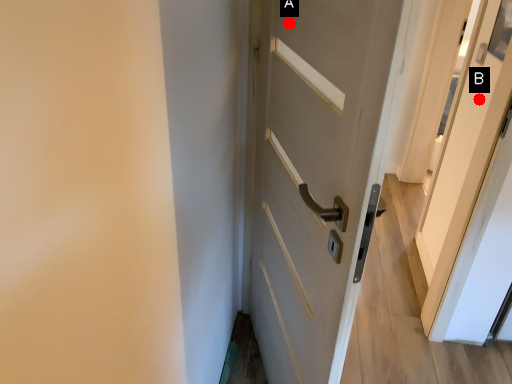
Question: Two points are circled on the image, labeled by A and B beside each circle. Which point appears farthest from the camera in this image?

Choices:
 (A) A is further
 (B) B is further

Answer: (B)